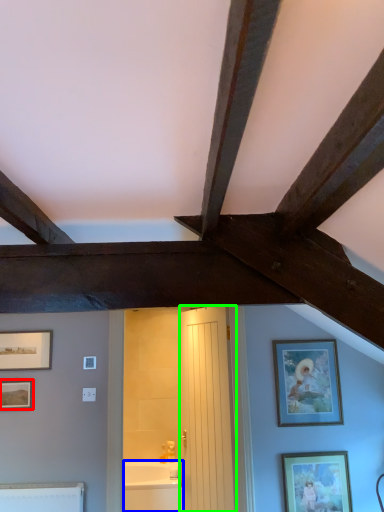
Question: Which object is positioned farthest from picture frame (highlighted by a red box)? Select from bathtub (highlighted by a blue box) and door (highlighted by a green box).

Choices:
 (A) bathtub
 (B) door

Answer: (A)